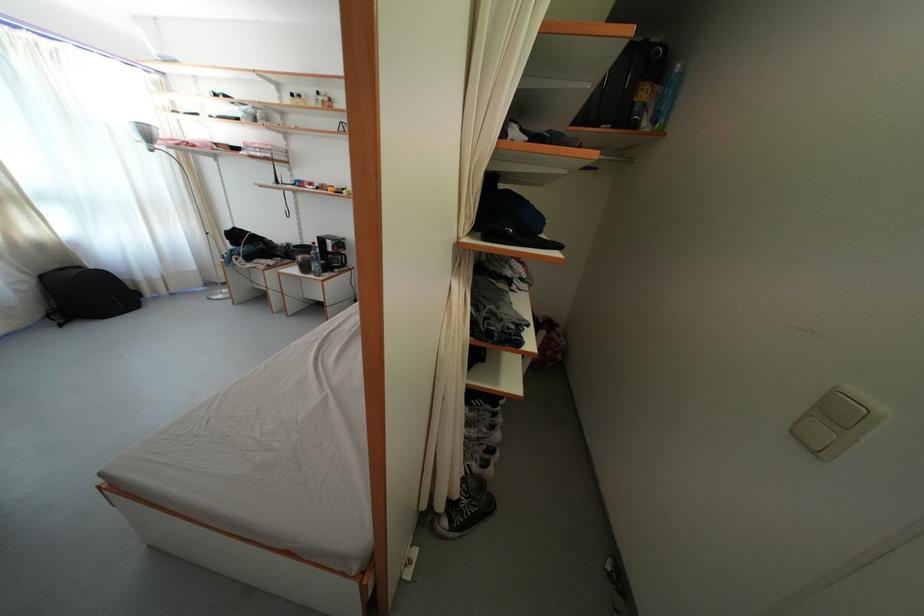
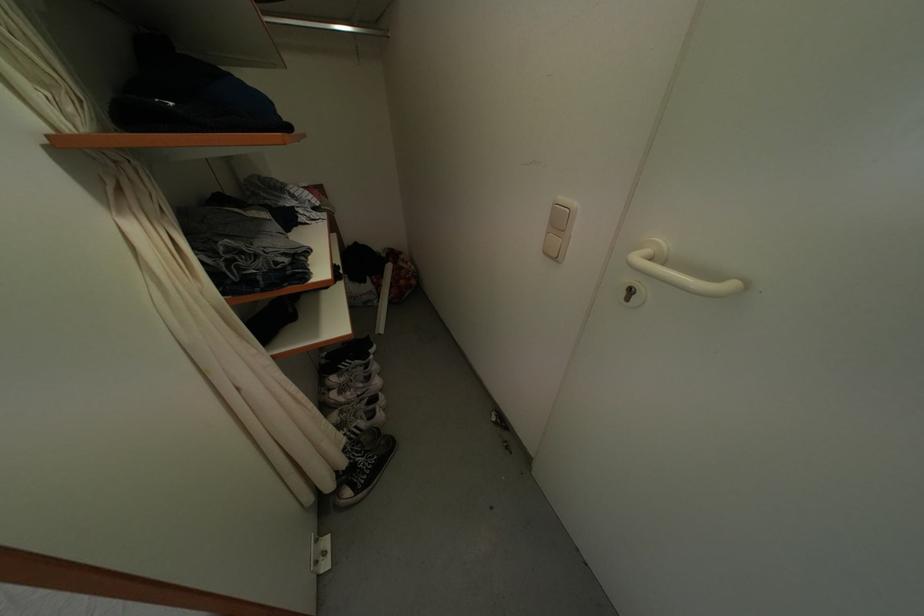
Find the pixel in the second image that matches (475,472) in the first image.

(361, 432)